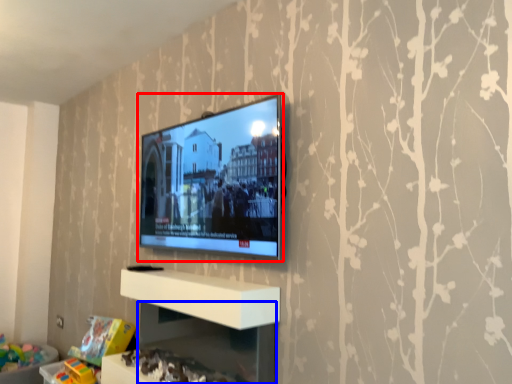
Question: Which of the following is the closest to the observer, television (highlighted by a red box) or shelf (highlighted by a blue box)?

Choices:
 (A) television
 (B) shelf

Answer: (B)